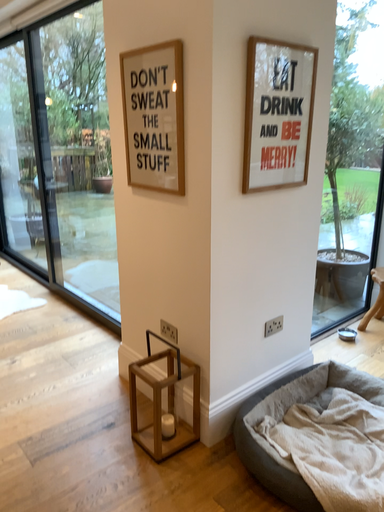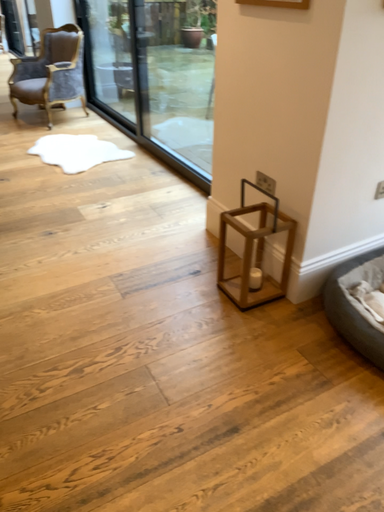
Question: Which way did the camera rotate in the video?

Choices:
 (A) rotated downward
 (B) rotated upward

Answer: (A)